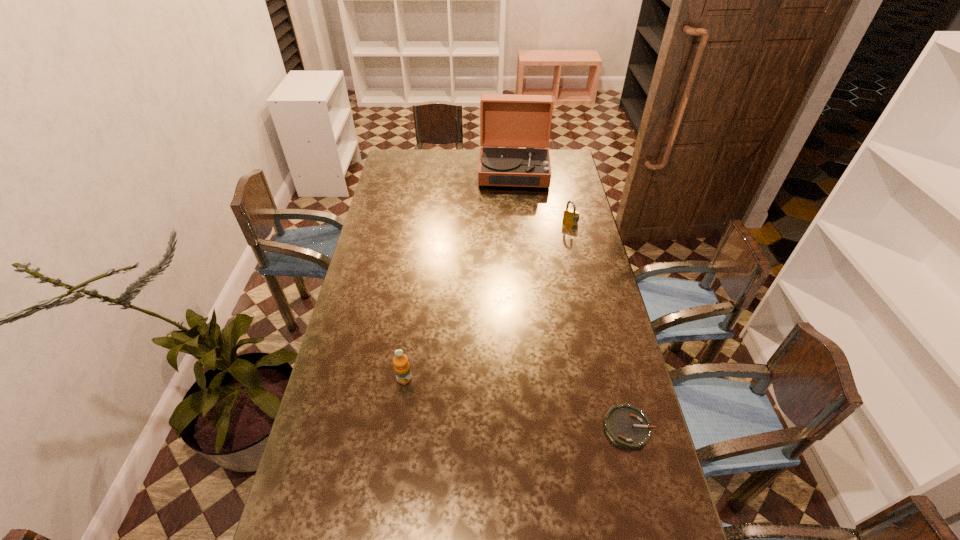
This screenshot has width=960, height=540. I want to click on free spot on the desktop that is between the third farthest object and the nearest object and is positioned on the side with the combination dials of the padlock, so [490, 397].

Locate an element on the screen. free spot on the desktop that is between the orange juice and the ashtray and is positioned on the face of the second object from left to right is located at coordinates (514, 402).